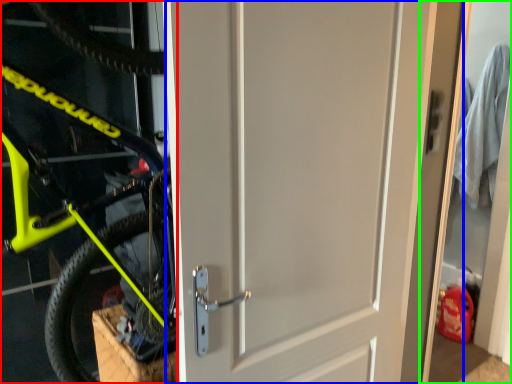
Question: Estimate the real-world distances between objects in this image. Which object is farther from bicycle (highlighted by a red box), door (highlighted by a blue box) or garage door (highlighted by a green box)?

Choices:
 (A) door
 (B) garage door

Answer: (B)